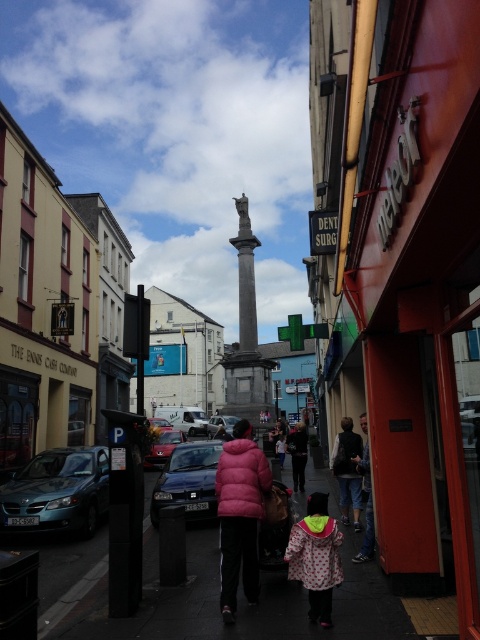
You are standing at the center of the street in the image. You see a pink fuzzy coat at center. Where exactly is the pink fuzzy coat located in relation to the center of the street?

The pink fuzzy coat at center is located at point coordinates 0.711 on the x axis and 0.621 on the y axis relative to the center of the street.

You are standing at the point labeled point (188, 481) in the image. What object are you currently standing on?

You are standing on the shiny black sedan at center.